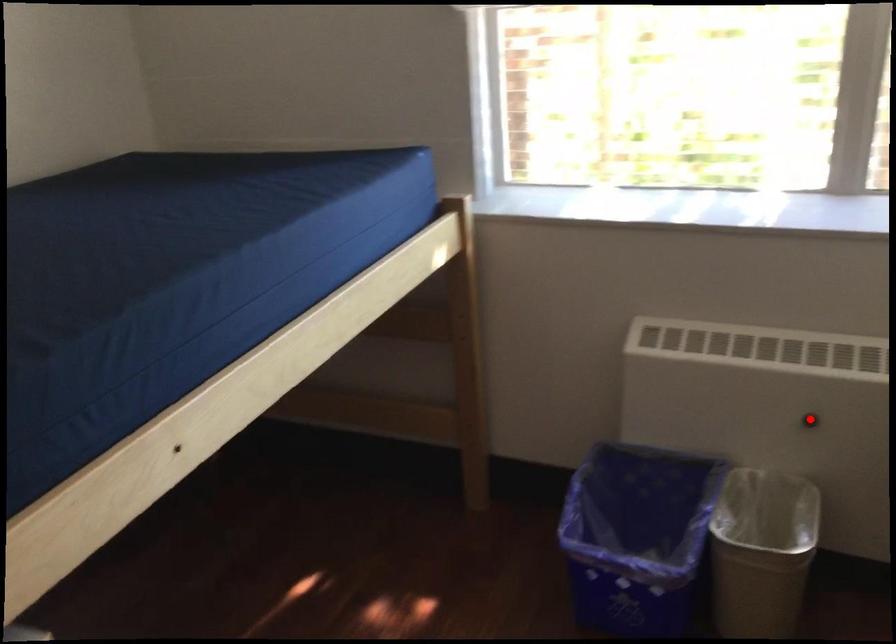
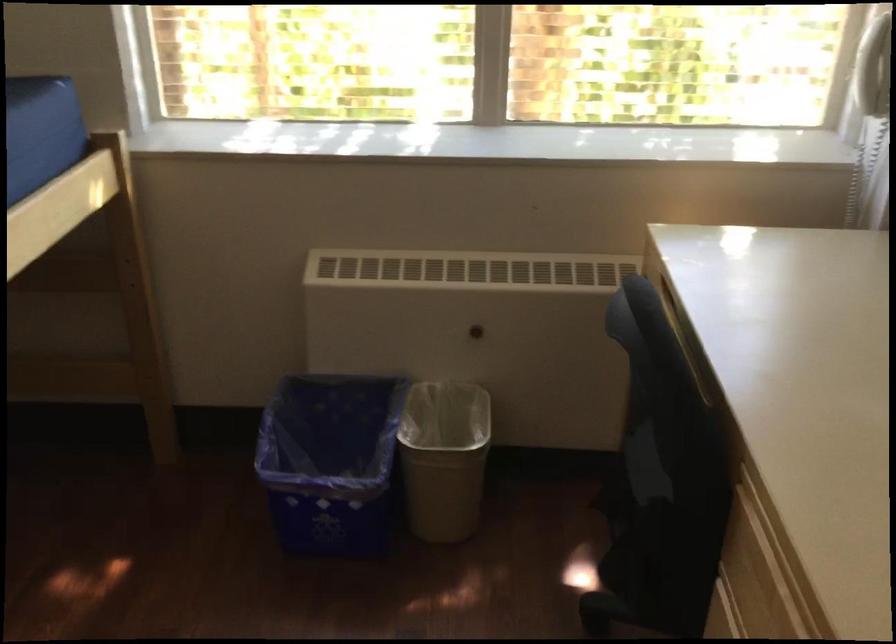
Question: I am providing you with two images of the same scene from different viewpoints. Given a red point in image1, look at the same physical point in image2. Is it:

Choices:
 (A) Closer to the viewpoint
 (B) Farther from the viewpoint

Answer: (B)